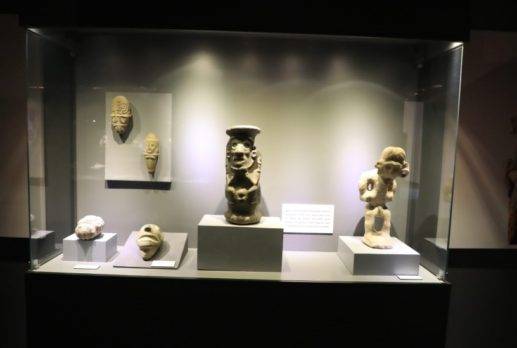
This screenshot has width=517, height=348. Find the location of `floor`. floor is located at coordinates [x=477, y=324], [x=11, y=293].